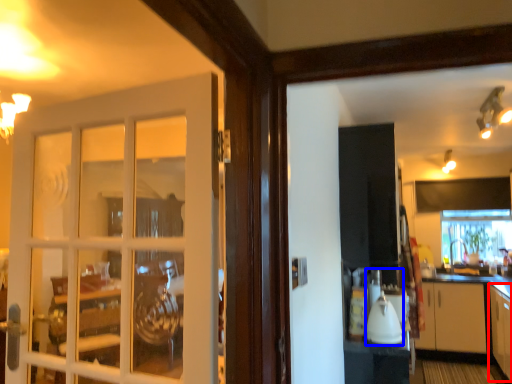
Question: Which point is further to the camera, cabinetry (highlighted by a red box) or appliance (highlighted by a blue box)?

Choices:
 (A) cabinetry
 (B) appliance

Answer: (A)